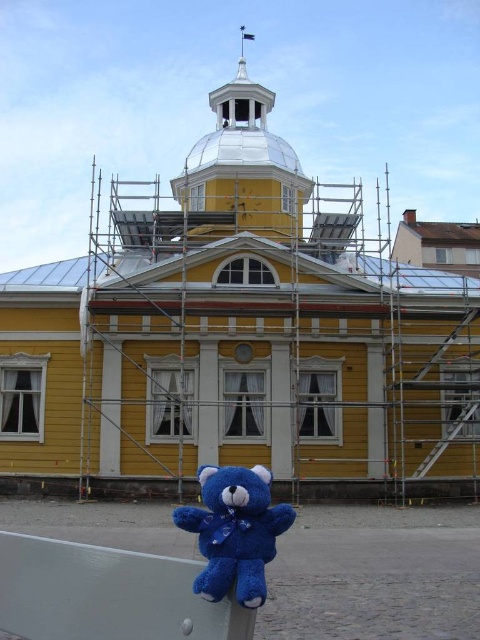
Can you confirm if yellow wooden church at center is bigger than blue plush bear at lower center?

Indeed, yellow wooden church at center has a larger size compared to blue plush bear at lower center.

Who is more distant from viewer, (244, 460) or (250, 500)?

Point (244, 460)

Where is `yellow wooden church at center`? yellow wooden church at center is located at coordinates (241, 333).